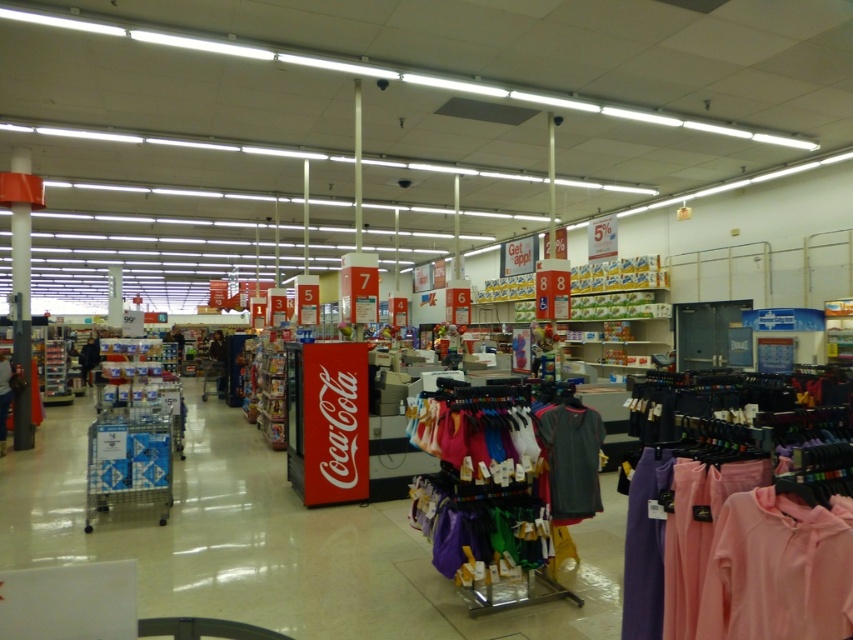
You are in a store and need to find the dark gray jersey at center. According to the coordinates provided, where should you look?

The dark gray jersey at center is located at coordinates point (x=572, y=458).

Consider the image. You are shopping in the store and want to find both the dark gray jersey at center and the matte black hoodie at center. According to the store layout, which item is placed higher up on the shelf?

The dark gray jersey at center is located above the matte black hoodie at center, so it is placed higher up on the shelf.